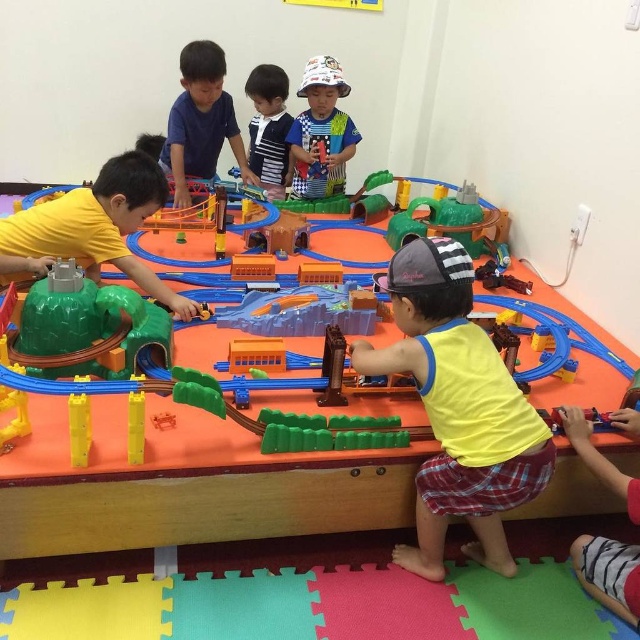
Who is shorter, white cotton hat at center or green plastic train track at center?

With less height is green plastic train track at center.

Does white cotton hat at center have a lesser width compared to green plastic train track at center?

Indeed, white cotton hat at center has a lesser width compared to green plastic train track at center.

The image size is (640, 640). What do you see at coordinates (321, 131) in the screenshot?
I see `white cotton hat at center` at bounding box center [321, 131].

This screenshot has width=640, height=640. What are the coordinates of `white cotton hat at center` in the screenshot? It's located at (321, 131).

Between yellow fabric shirt at center and matte blue shirt at center, which one is positioned lower?

yellow fabric shirt at center

Can you confirm if yellow fabric shirt at center is positioned to the left of matte blue shirt at center?

No, yellow fabric shirt at center is not to the left of matte blue shirt at center.

Who is more forward, (532, 493) or (241, 164)?

Point (532, 493)

In order to click on yellow fabric shirt at center in this screenshot , I will do `click(458, 408)`.

Can you confirm if matte blue shirt at center is shorter than white cotton hat at center?

No.

Can you confirm if matte blue shirt at center is positioned to the left of white cotton hat at center?

Yes, matte blue shirt at center is to the left of white cotton hat at center.

The height and width of the screenshot is (640, 640). Find the location of `matte blue shirt at center`. matte blue shirt at center is located at coordinates (200, 122).